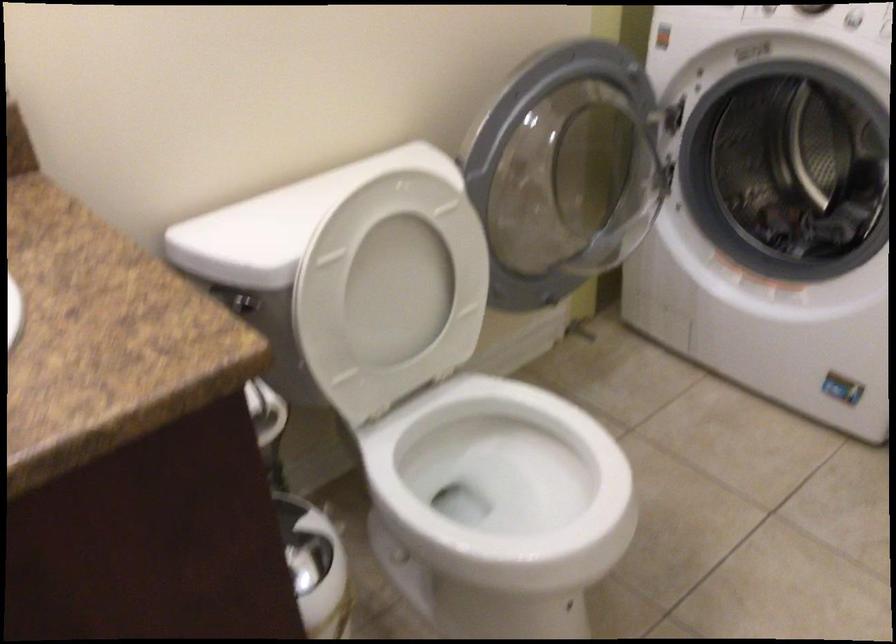
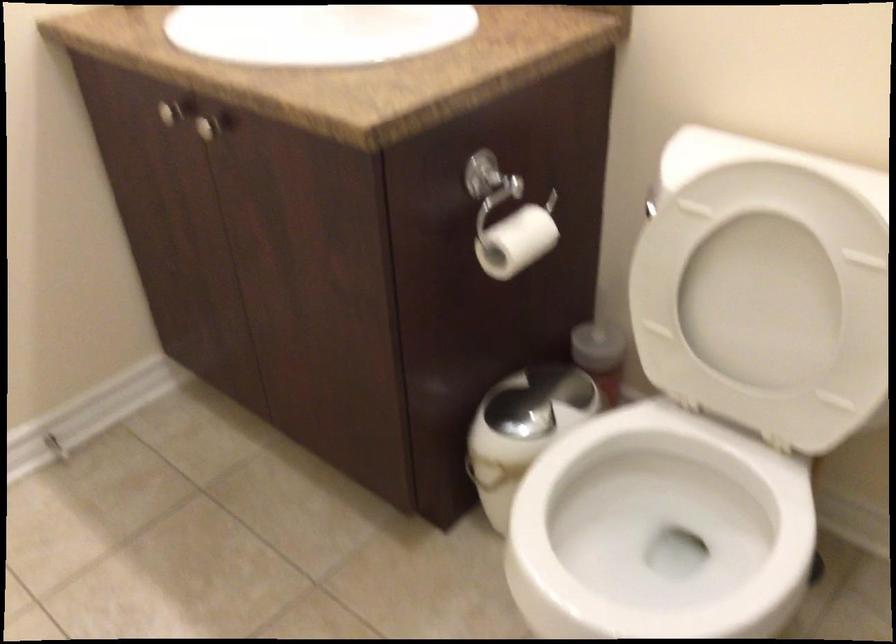
Find the pixel in the second image that matches (312,551) in the first image.

(529, 413)